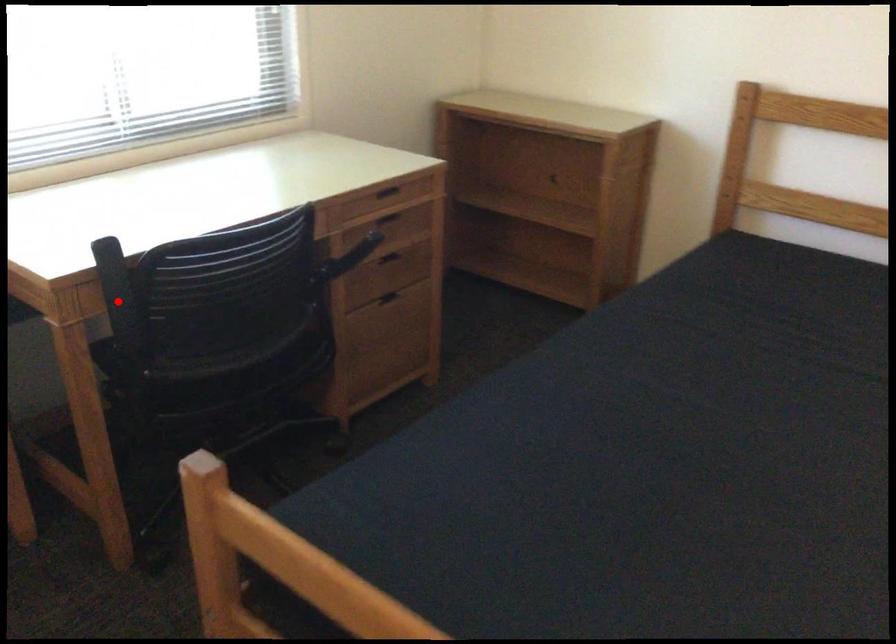
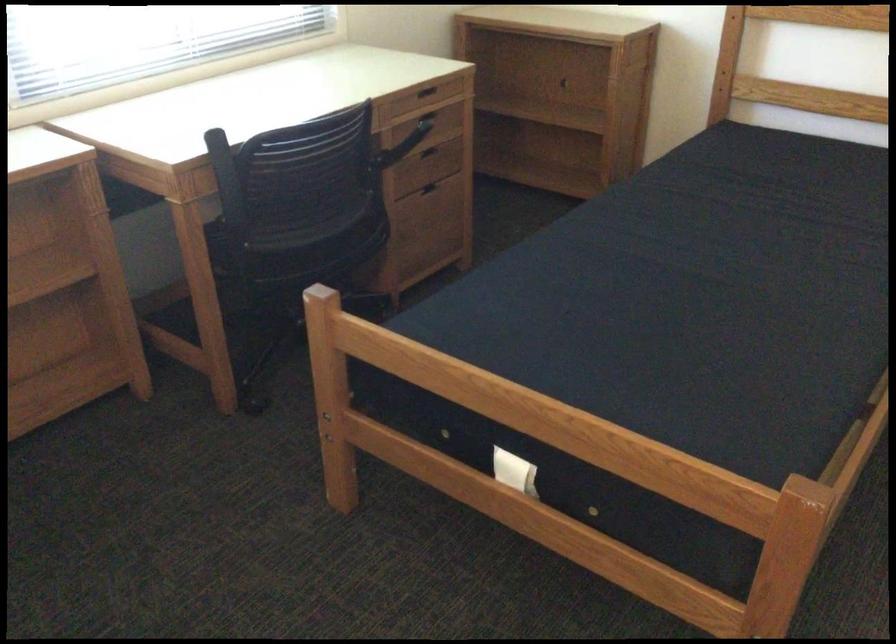
The point at the highlighted location is marked in the first image. Where is the corresponding point in the second image?

(227, 182)